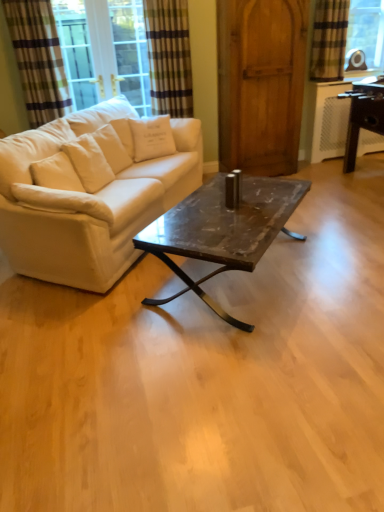
Image resolution: width=384 pixels, height=512 pixels. Find the location of `vacant area that is in front of marble/black metal coffee table at center`. vacant area that is in front of marble/black metal coffee table at center is located at coordinates (241, 365).